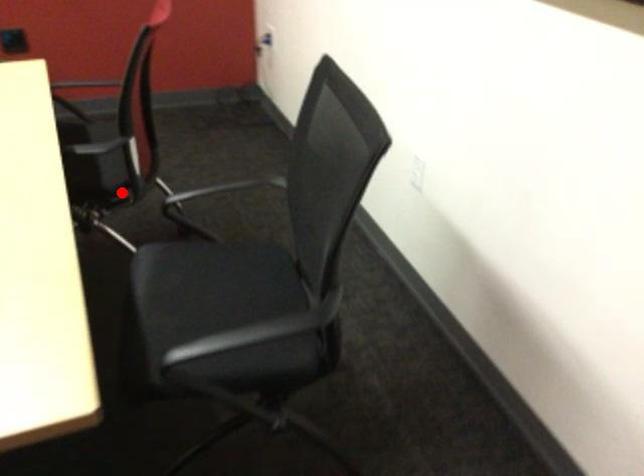
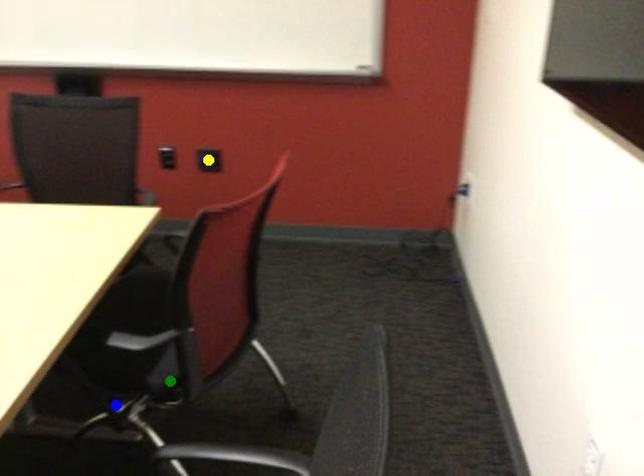
Question: I am providing you with two images of the same scene from different viewpoints. A red point is marked on the first image. You are given multiple points on the second image. Which point in image 2 is actually the same real-world point as the red point in image 1?

Choices:
 (A) yellow point
 (B) green point
 (C) blue point

Answer: (B)